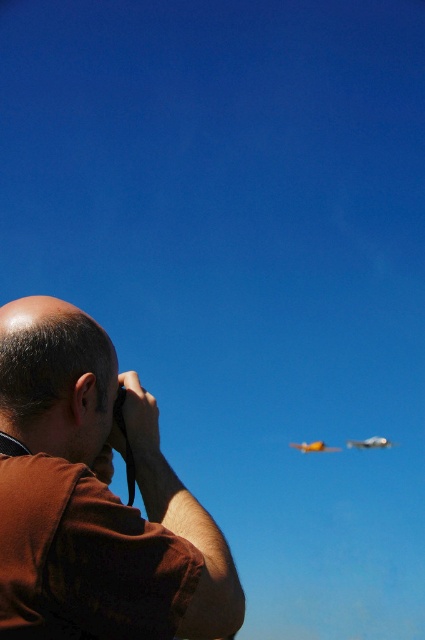
Question: Does yellow matte airplane at lower center have a smaller size compared to metallic silver airplane at upper right?

Choices:
 (A) yes
 (B) no

Answer: (A)

Question: Which object is farther from the camera taking this photo?

Choices:
 (A) metallic silver airplane at upper right
 (B) yellow matte airplane at lower center
 (C) brown fabric shirt at left

Answer: (A)

Question: Can you confirm if brown fabric shirt at left is positioned above yellow matte airplane at lower center?

Choices:
 (A) no
 (B) yes

Answer: (B)

Question: Can you confirm if yellow matte airplane at lower center is positioned to the left of metallic silver airplane at upper right?

Choices:
 (A) yes
 (B) no

Answer: (B)

Question: Which point is farther from the camera taking this photo?

Choices:
 (A) (127, 589)
 (B) (387, 442)

Answer: (B)

Question: Which of the following is the closest to the observer?

Choices:
 (A) brown fabric shirt at left
 (B) metallic silver airplane at upper right
 (C) yellow matte airplane at lower center

Answer: (A)